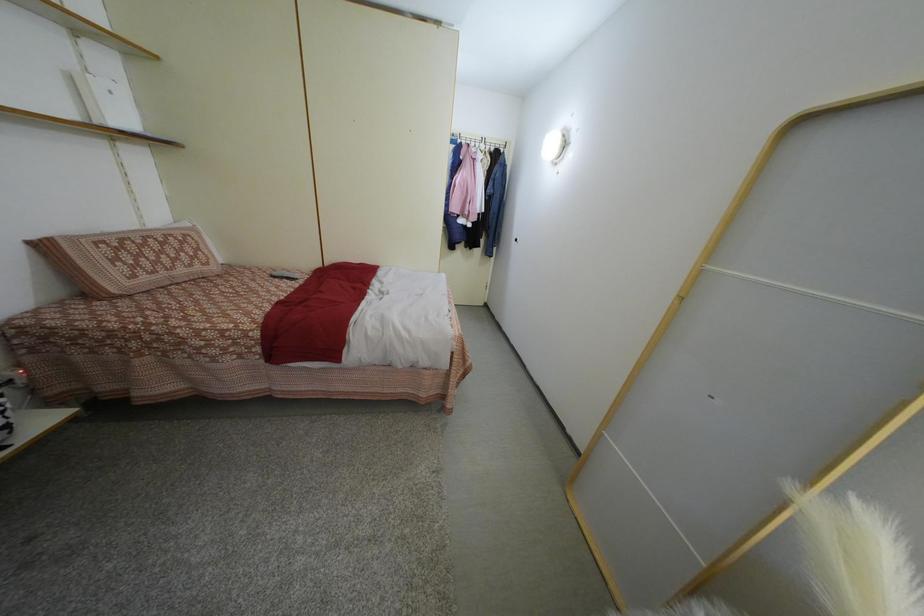
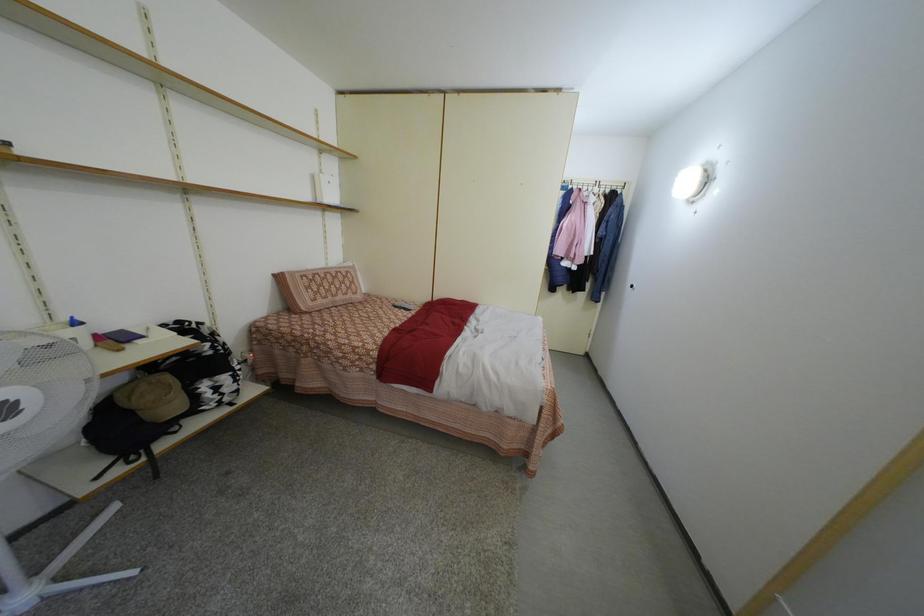
Question: Based on the continuous images, in which direction is the camera rotating? Reply with the corresponding letter.

Choices:
 (A) Left
 (B) Right
 (C) Up
 (D) Down

Answer: (A)